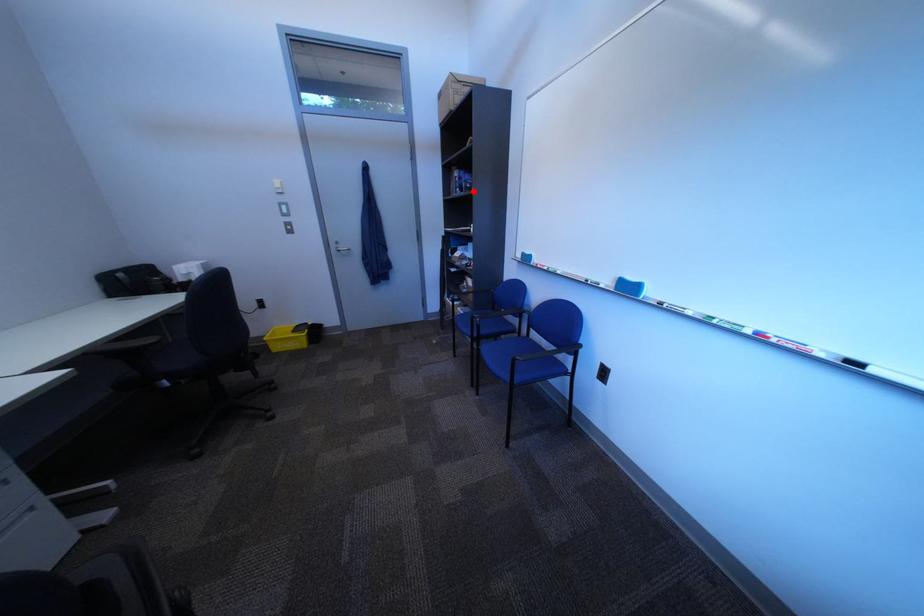
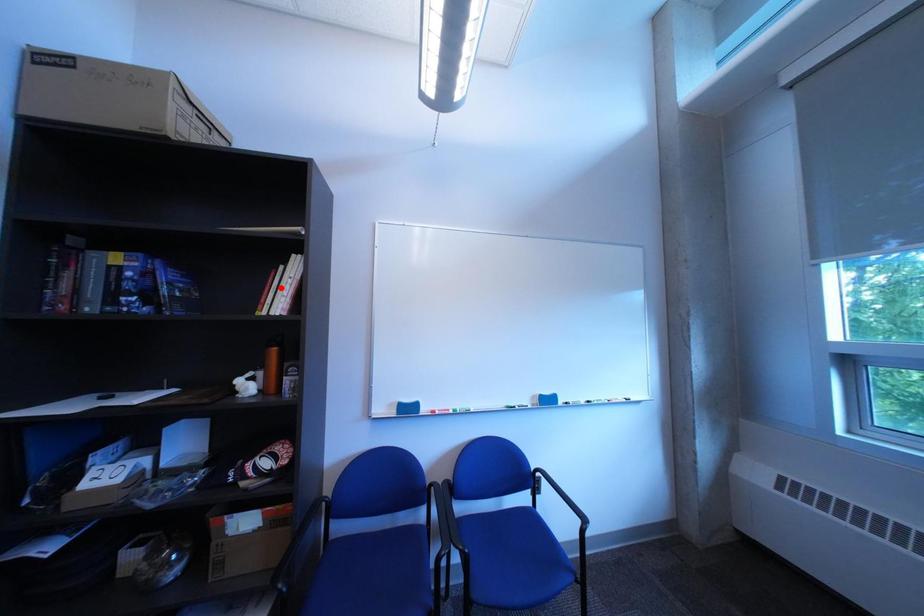
I am providing you with two images of the same scene from different viewpoints. A red point is marked on the first image and another point is marked on the second image. Do the highlighted points in image1 and image2 indicate the same real-world spot?

No